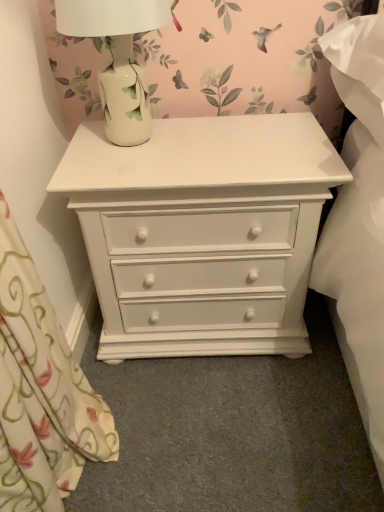
Describe the element at coordinates (202, 232) in the screenshot. The image size is (384, 512). I see `white painted wood chest of drawers at center` at that location.

I want to click on white painted wood chest of drawers at center, so click(202, 232).

Measure the distance between white painted wood chest of drawers at center and camera.

white painted wood chest of drawers at center and camera are 88.95 centimeters apart from each other.

The height and width of the screenshot is (512, 384). What do you see at coordinates (118, 58) in the screenshot? I see `white ceramic lamp at upper left` at bounding box center [118, 58].

At what (x,y) coordinates should I click in order to perform the action: click on white ceramic lamp at upper left. Please return your answer as a coordinate pair (x, y). Looking at the image, I should click on (118, 58).

Identify the location of white painted wood chest of drawers at center. (202, 232).

Would you say white ceramic lamp at upper left is to the left or to the right of white painted wood chest of drawers at center in the picture?

white ceramic lamp at upper left is positioned on white painted wood chest of drawers at center's left side.

Is white ceramic lamp at upper left in front of or behind white painted wood chest of drawers at center in the image?

Clearly, white ceramic lamp at upper left is in front of white painted wood chest of drawers at center.

Which point is more forward, (113, 139) or (284, 121)?

The point (113, 139) is in front.

From the image's perspective, which one is positioned lower, white ceramic lamp at upper left or white painted wood chest of drawers at center?

white painted wood chest of drawers at center, from the image's perspective.

From a real-world perspective, is white ceramic lamp at upper left beneath white painted wood chest of drawers at center?

No.

Does white ceramic lamp at upper left have a greater width compared to white painted wood chest of drawers at center?

No.

Who is taller, white ceramic lamp at upper left or white painted wood chest of drawers at center?

Standing taller between the two is white painted wood chest of drawers at center.

Considering the relative sizes of white ceramic lamp at upper left and white painted wood chest of drawers at center in the image provided, is white ceramic lamp at upper left bigger than white painted wood chest of drawers at center?

No.

Is white ceramic lamp at upper left situated inside white painted wood chest of drawers at center or outside?

white ceramic lamp at upper left is not enclosed by white painted wood chest of drawers at center.

Are white ceramic lamp at upper left and white painted wood chest of drawers at center located far from each other?

white ceramic lamp at upper left is actually quite close to white painted wood chest of drawers at center.

Is white painted wood chest of drawers at center at the back of white ceramic lamp at upper left?

No, white ceramic lamp at upper left is not facing away from white painted wood chest of drawers at center.

How many degrees apart are the facing directions of white ceramic lamp at upper left and white painted wood chest of drawers at center?

The facing directions of white ceramic lamp at upper left and white painted wood chest of drawers at center are 1.82 degrees apart.

This screenshot has height=512, width=384. I want to click on table lamp in front of the white painted wood chest of drawers at center, so click(118, 58).

Can you confirm if white painted wood chest of drawers at center is positioned to the right of white ceramic lamp at upper left?

Correct, you'll find white painted wood chest of drawers at center to the right of white ceramic lamp at upper left.

Is the position of white painted wood chest of drawers at center less distant than that of white ceramic lamp at upper left?

No, it is not.

Which point is more forward, (186, 283) or (121, 77)?

The point (121, 77) is in front.

From the image's perspective, is white painted wood chest of drawers at center beneath white ceramic lamp at upper left?

Correct, white painted wood chest of drawers at center appears lower than white ceramic lamp at upper left in the image.

From a real-world perspective, is white painted wood chest of drawers at center positioned over white ceramic lamp at upper left based on gravity?

No, from a real-world perspective, white painted wood chest of drawers at center is not on top of white ceramic lamp at upper left.

Which of these two, white painted wood chest of drawers at center or white ceramic lamp at upper left, is thinner?

white ceramic lamp at upper left.

From their relative heights in the image, would you say white painted wood chest of drawers at center is taller or shorter than white ceramic lamp at upper left?

In the image, white painted wood chest of drawers at center appears to be taller than white ceramic lamp at upper left.

Looking at this image, can you confirm if white painted wood chest of drawers at center is bigger than white ceramic lamp at upper left?

Correct, white painted wood chest of drawers at center is larger in size than white ceramic lamp at upper left.

Is white painted wood chest of drawers at center outside of white ceramic lamp at upper left?

Indeed, white painted wood chest of drawers at center is completely outside white ceramic lamp at upper left.

Consider the image. Are white painted wood chest of drawers at center and white ceramic lamp at upper left far apart?

No, white painted wood chest of drawers at center is in close proximity to white ceramic lamp at upper left.

Could you tell me if white painted wood chest of drawers at center is turned towards white ceramic lamp at upper left?

Result: No, white painted wood chest of drawers at center is not facing towards white ceramic lamp at upper left.

Can you tell me how much white painted wood chest of drawers at center and white ceramic lamp at upper left differ in facing direction?

white painted wood chest of drawers at center and white ceramic lamp at upper left are facing 1.82 degrees away from each other.

Locate an element on the screen. Image resolution: width=384 pixels, height=512 pixels. table lamp that is above the white painted wood chest of drawers at center (from a real-world perspective) is located at coordinates (118, 58).

The width and height of the screenshot is (384, 512). I want to click on chest of drawers below the white ceramic lamp at upper left (from a real-world perspective), so click(202, 232).

You are a GUI agent. You are given a task and a screenshot of the screen. Output one action in this format:
    pyautogui.click(x=<x>, y=<y>)
    Task: Click on the table lamp that appears above the white painted wood chest of drawers at center (from the image's perspective)
    The width and height of the screenshot is (384, 512).
    Given the screenshot: What is the action you would take?
    pyautogui.click(x=118, y=58)